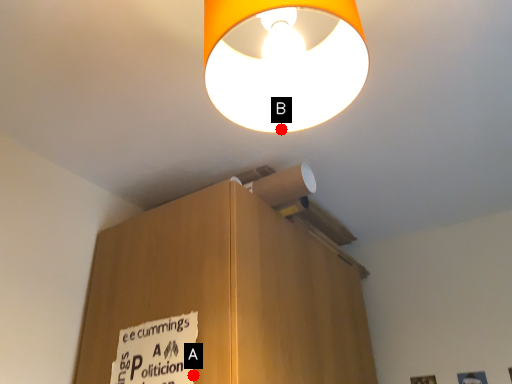
Question: Two points are circled on the image, labeled by A and B beside each circle. Among these points, which one is farthest from the camera?

Choices:
 (A) A is further
 (B) B is further

Answer: (A)